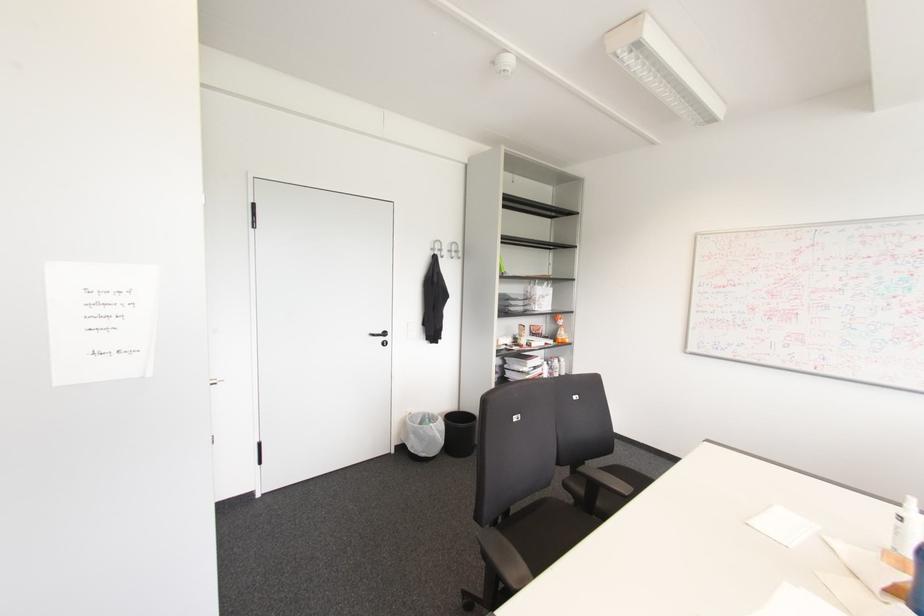
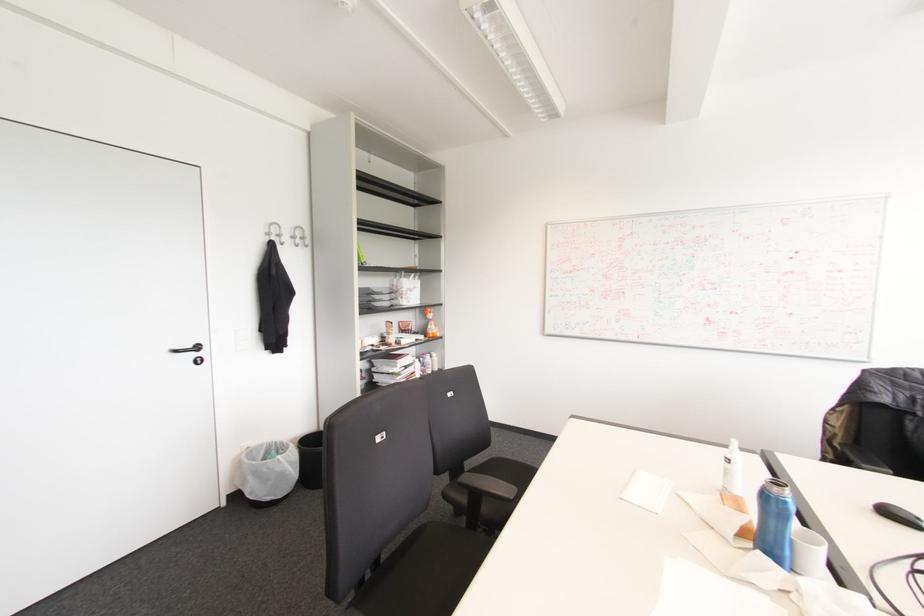
Find the pixel in the second image that matches (630,488) in the first image.

(515, 488)